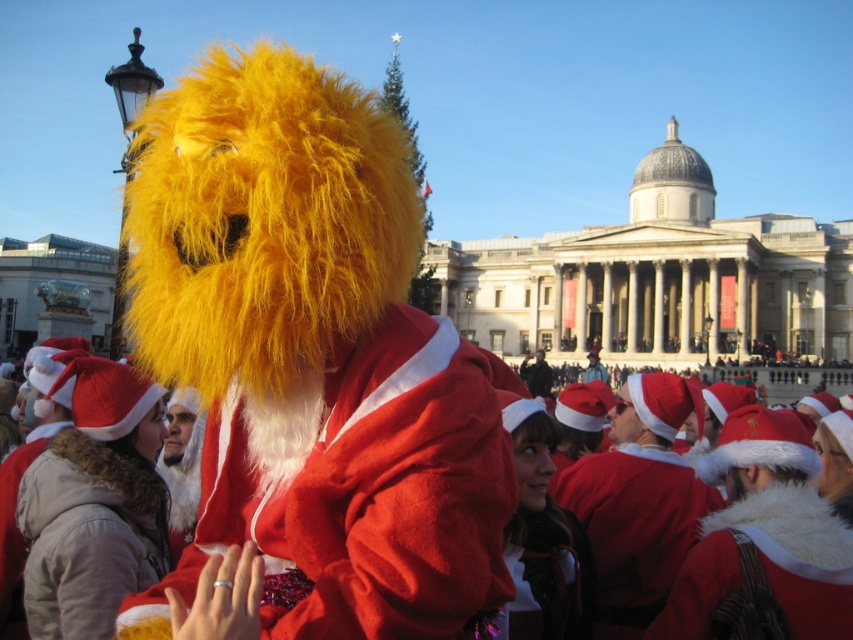
Question: Based on their relative distances, which object is nearer to the fuzzy yellow mask at center?

Choices:
 (A) black fuzzy hat at center
 (B) fuzzy red santa suit at center

Answer: (B)

Question: Is fuzzy yellow mask at center to the left of fuzzy red santa suit at center from the viewer's perspective?

Choices:
 (A) yes
 (B) no

Answer: (A)

Question: Can you confirm if fuzzy yellow mask at center is wider than black fuzzy hat at center?

Choices:
 (A) yes
 (B) no

Answer: (A)

Question: Which point is farther to the camera?

Choices:
 (A) (535, 376)
 (B) (195, 148)

Answer: (A)

Question: Which object is positioned farthest from the fuzzy yellow mask at center?

Choices:
 (A) fuzzy red santa suit at center
 (B) black fuzzy hat at center

Answer: (B)

Question: From the image, what is the correct spatial relationship of fuzzy yellow mask at center in relation to black fuzzy hat at center?

Choices:
 (A) above
 (B) below

Answer: (A)